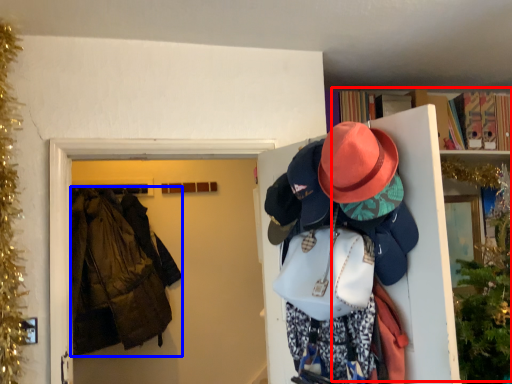
Question: Which object is further to the camera taking this photo, bookcase (highlighted by a red box) or jacket (highlighted by a blue box)?

Choices:
 (A) bookcase
 (B) jacket

Answer: (B)